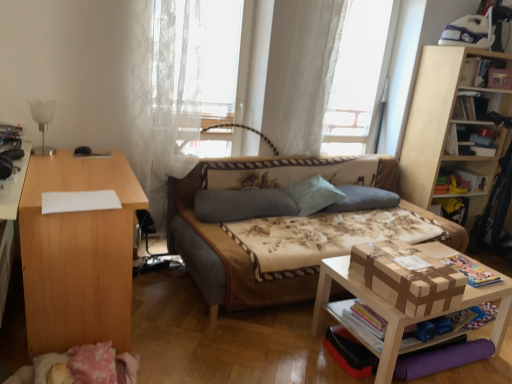
Find the location of `vacant space in white lace curtain at upper center, which ranks as the first curtain in right-to-left order (from a real-world perspective)`. vacant space in white lace curtain at upper center, which ranks as the first curtain in right-to-left order (from a real-world perspective) is located at coordinates (316, 160).